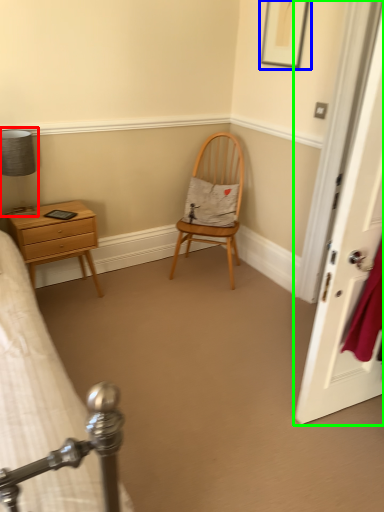
Question: Based on their relative distances, which object is farther from bedside lamp (highlighted by a red box)? Choose from picture frame (highlighted by a blue box) and door (highlighted by a green box).

Choices:
 (A) picture frame
 (B) door

Answer: (B)